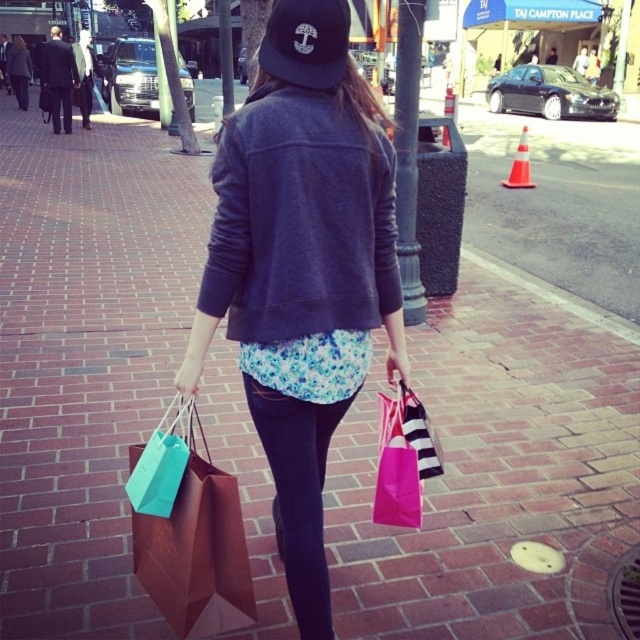
Is black metal pole at center above teal paper bag at lower left?

Yes, black metal pole at center is above teal paper bag at lower left.

Can you confirm if black metal pole at center is positioned to the right of teal paper bag at lower left?

Indeed, black metal pole at center is positioned on the right side of teal paper bag at lower left.

Locate an element on the screen. black metal pole at center is located at coordinates (406, 154).

Does matte gray sweatshirt at center have a lesser height compared to brushed metal pole at center?

Yes, matte gray sweatshirt at center is shorter than brushed metal pole at center.

Does matte gray sweatshirt at center have a smaller size compared to brushed metal pole at center?

Yes.

This screenshot has width=640, height=640. What do you see at coordinates (301, 268) in the screenshot?
I see `matte gray sweatshirt at center` at bounding box center [301, 268].

At what (x,y) coordinates should I click in order to perform the action: click on matte gray sweatshirt at center. Please return your answer as a coordinate pair (x, y). Looking at the image, I should click on (301, 268).

Which is above, brown paper bag at lower left or pink paper bag at lower center?

pink paper bag at lower center is above.

Who is positioned more to the right, brown paper bag at lower left or pink paper bag at lower center?

pink paper bag at lower center

The width and height of the screenshot is (640, 640). Find the location of `brown paper bag at lower left`. brown paper bag at lower left is located at coordinates (192, 536).